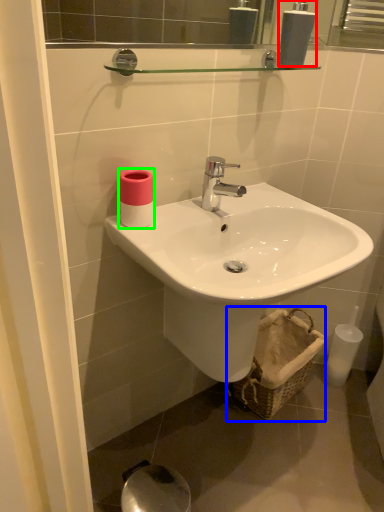
Question: Based on their relative distances, which object is nearer to soap dispenser (highlighted by a red box)? Choose from basket (highlighted by a blue box) and toiletry (highlighted by a green box).

Choices:
 (A) basket
 (B) toiletry

Answer: (B)